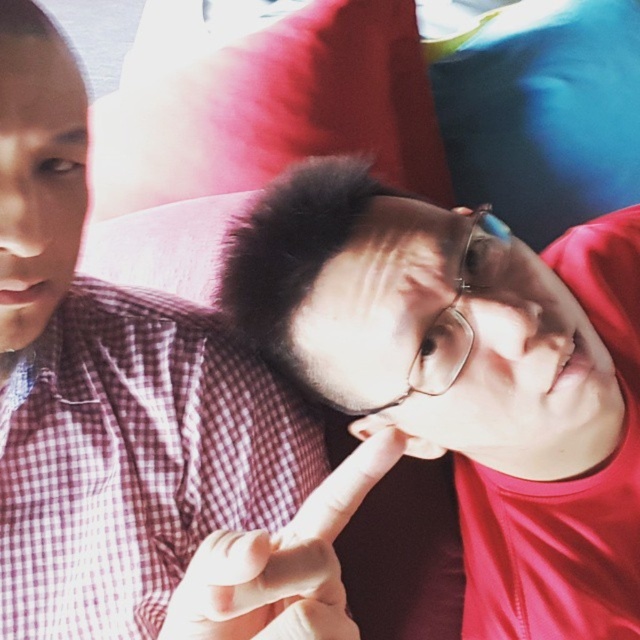
Can you confirm if matte red shirt at center is smaller than matte red pillow at upper center?

No.

What do you see at coordinates (472, 376) in the screenshot? I see `matte red shirt at center` at bounding box center [472, 376].

Find the location of a particular element. This screenshot has height=640, width=640. matte red shirt at center is located at coordinates (472, 376).

Is matte red pillow at upper center to the left of white matte finger at center from the viewer's perspective?

Indeed, matte red pillow at upper center is positioned on the left side of white matte finger at center.

Who is more distant from viewer, (276, 35) or (248, 556)?

The point (276, 35) is behind.

In order to click on matte red pillow at upper center in this screenshot , I will do `click(273, 109)`.

Is matte checkered shirt at left wider than matte red pillow at upper center?

Incorrect, matte checkered shirt at left's width does not surpass matte red pillow at upper center's.

Which is behind, point (273, 445) or point (237, 129)?

The point (237, 129) is behind.

Between point (204, 538) and point (145, 125), which one is positioned in front?

Point (204, 538)

The height and width of the screenshot is (640, 640). Identify the location of matte checkered shirt at left. (36, 179).